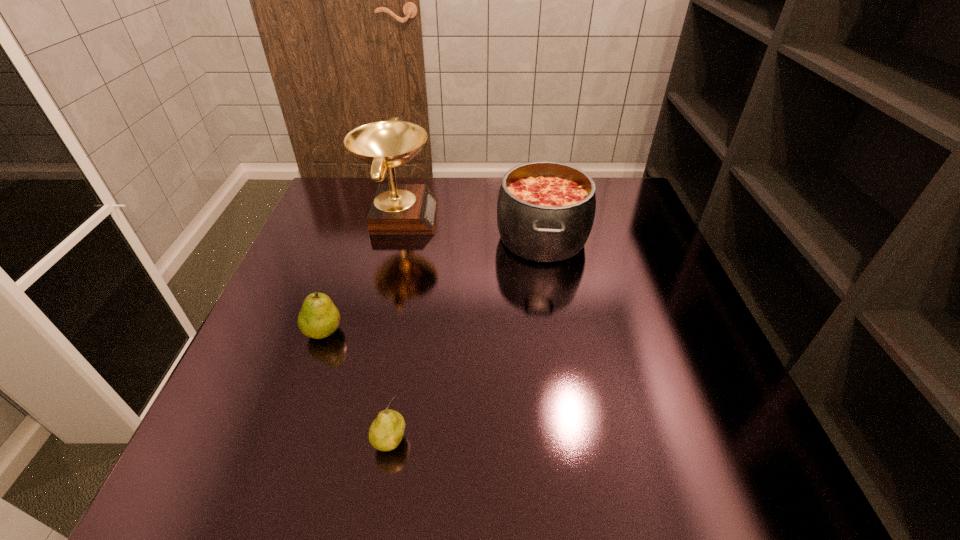
Image resolution: width=960 pixels, height=540 pixels. Identify the location of free region at the right edge of the desktop. (645, 293).

This screenshot has height=540, width=960. Identify the location of free space at the far left corner of the desktop. (361, 217).

The height and width of the screenshot is (540, 960). I want to click on free space at the far right corner of the desktop, so click(630, 178).

You are a GUI agent. You are given a task and a screenshot of the screen. Output one action in this format:
    pyautogui.click(x=<x>, y=<y>)
    Task: Click on the vacant region at the near right corner of the desktop
    Image resolution: width=960 pixels, height=540 pixels.
    Given the screenshot: What is the action you would take?
    pyautogui.click(x=690, y=492)

Identify the location of free area in between the left pear and the right pear. (357, 386).

Locate an element on the screen. free area in between the farther pear and the casserole is located at coordinates point(433,285).

Locate an element on the screen. The width and height of the screenshot is (960, 540). vacant area that lies between the casserole and the taller pear is located at coordinates (433, 285).

Locate an element on the screen. The image size is (960, 540). blank region between the casserole and the award is located at coordinates (470, 227).

In order to click on unoccupied position between the shortest object and the left pear in this screenshot , I will do click(x=357, y=386).

Find the location of `free area in between the shortest object and the tallest object`. free area in between the shortest object and the tallest object is located at coordinates (395, 328).